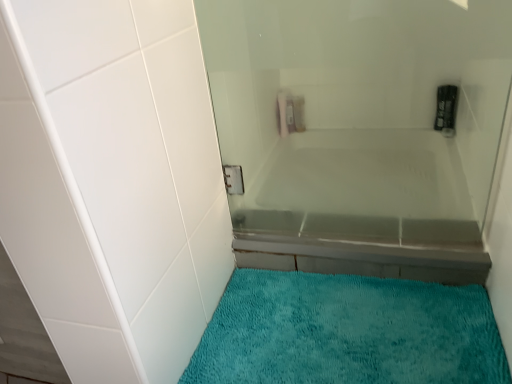
Question: Is white glossy bathtub at center thinner than teal plush bath mat at lower center?

Choices:
 (A) yes
 (B) no

Answer: (A)

Question: Are white glossy bathtub at center and teal plush bath mat at lower center beside each other?

Choices:
 (A) no
 (B) yes

Answer: (A)

Question: From the image's perspective, is white glossy bathtub at center on top of teal plush bath mat at lower center?

Choices:
 (A) no
 (B) yes

Answer: (B)

Question: Is white glossy bathtub at center bigger than teal plush bath mat at lower center?

Choices:
 (A) no
 (B) yes

Answer: (B)

Question: Considering the relative positions of white glossy bathtub at center and teal plush bath mat at lower center in the image provided, is white glossy bathtub at center in front of teal plush bath mat at lower center?

Choices:
 (A) yes
 (B) no

Answer: (B)

Question: Does white glossy bathtub at center have a greater width compared to teal plush bath mat at lower center?

Choices:
 (A) no
 (B) yes

Answer: (A)

Question: Is teal plush bath mat at lower center at the right side of white glossy bathtub at center?

Choices:
 (A) yes
 (B) no

Answer: (B)

Question: From a real-world perspective, is teal plush bath mat at lower center on top of white glossy bathtub at center?

Choices:
 (A) no
 (B) yes

Answer: (A)

Question: From a real-world perspective, does teal plush bath mat at lower center sit lower than white glossy bathtub at center?

Choices:
 (A) yes
 (B) no

Answer: (A)

Question: Is teal plush bath mat at lower center facing away from white glossy bathtub at center?

Choices:
 (A) yes
 (B) no

Answer: (B)

Question: Is teal plush bath mat at lower center not within white glossy bathtub at center?

Choices:
 (A) yes
 (B) no

Answer: (A)

Question: Does teal plush bath mat at lower center have a larger size compared to white glossy bathtub at center?

Choices:
 (A) yes
 (B) no

Answer: (B)

Question: From a real-world perspective, is white glossy bathtub at center physically located above or below teal plush bath mat at lower center?

Choices:
 (A) above
 (B) below

Answer: (A)